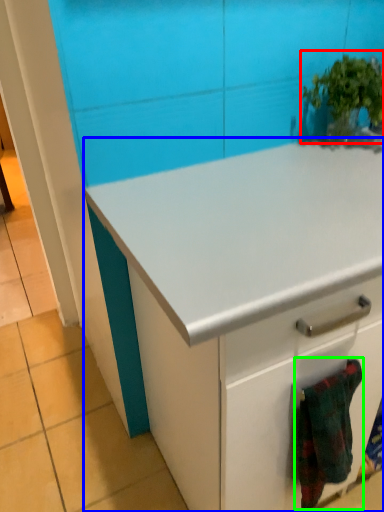
Question: Which object is positioned closest to houseplant (highlighted by a red box)? Select from cabinetry (highlighted by a blue box) and blanket (highlighted by a green box).

Choices:
 (A) cabinetry
 (B) blanket

Answer: (A)